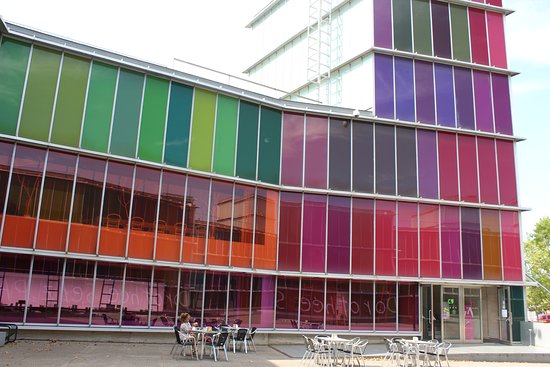
Identify the location of chairs. The image size is (550, 367). (433, 352), (404, 354), (355, 354), (319, 347), (245, 339), (218, 343), (188, 342).